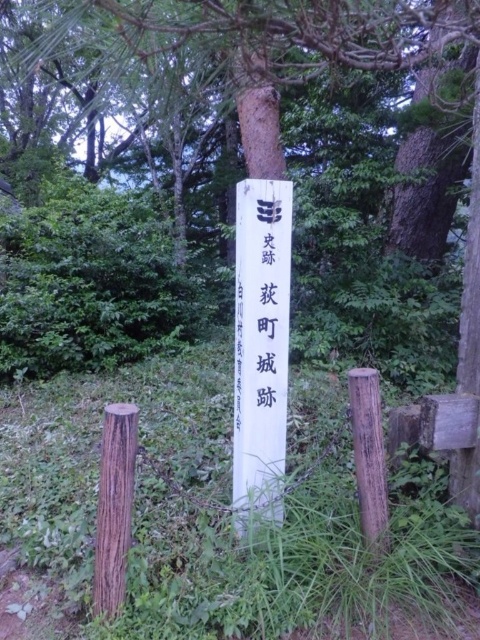
You are a park ranger who needs to replace the chain connecting the white wood post at center and the brown wooden post at center. The new chain you have is 10 feet long. Will the chain be long enough to connect them?

The white wood post at center is 9.23 feet away from brown wooden post at center. Since the new chain is 10 feet long, it will be long enough to connect them as 10 feet is longer than 9.23 feet.